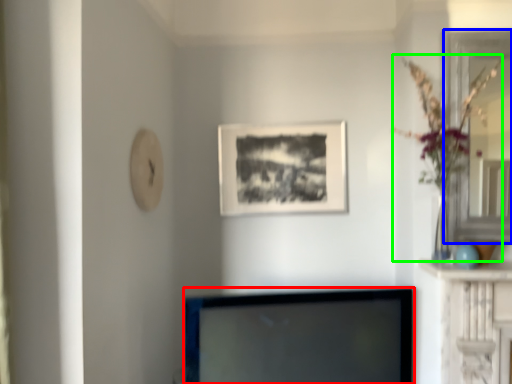
Question: Which object is positioned closest to television (highlighted by a red box)? Select from glass door (highlighted by a blue box) and floral arrangement (highlighted by a green box).

Choices:
 (A) glass door
 (B) floral arrangement

Answer: (B)